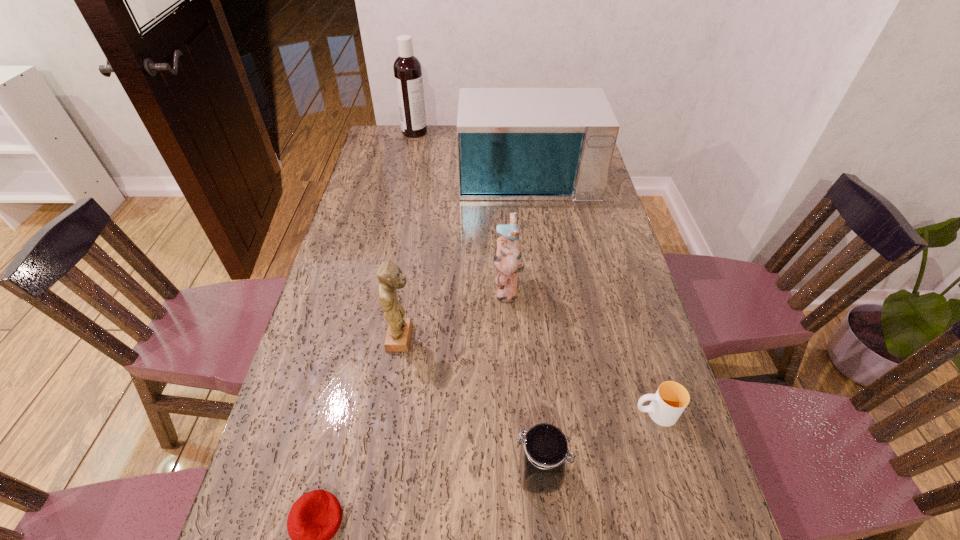
Where is `the farthest object`? The image size is (960, 540). the farthest object is located at coordinates (407, 68).

At what (x,y) coordinates should I click in order to perform the action: click on dishwasher detergent. Please return your answer as a coordinate pair (x, y). The width and height of the screenshot is (960, 540). Looking at the image, I should click on (407, 68).

At what (x,y) coordinates should I click in order to perform the action: click on the sixth nearest object. Please return your answer as a coordinate pair (x, y). This screenshot has width=960, height=540. Looking at the image, I should click on (514, 144).

You are a GUI agent. You are given a task and a screenshot of the screen. Output one action in this format:
    pyautogui.click(x=<x>, y=<y>)
    Task: Click on the nearer figurine
    
    Given the screenshot: What is the action you would take?
    pyautogui.click(x=399, y=331)

The image size is (960, 540). I want to click on the left figurine, so click(399, 331).

Identify the location of the farther figurine. Image resolution: width=960 pixels, height=540 pixels. (508, 260).

In order to click on the right figurine in this screenshot , I will do `click(508, 260)`.

Find the location of a particular element. This screenshot has height=540, width=960. jar is located at coordinates (543, 450).

The width and height of the screenshot is (960, 540). Identify the location of the fifth farthest object. (670, 400).

I want to click on the second shortest object, so click(x=670, y=400).